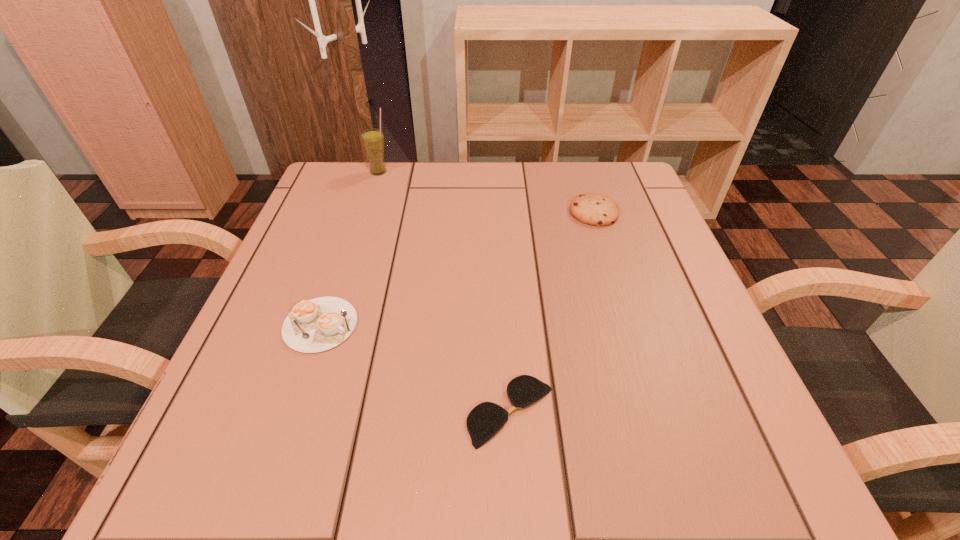
Identify the location of unoccupied area between the tallest object and the third object from left to right. (444, 292).

Where is `vacant area between the third tallest object and the shortest object`? vacant area between the third tallest object and the shortest object is located at coordinates (416, 368).

The height and width of the screenshot is (540, 960). What are the coordinates of `free space between the third farthest object and the second object from right to left` in the screenshot? It's located at (416, 368).

The image size is (960, 540). Identify the location of vacant area between the tallest object and the cappuccino. pos(349,248).

Locate an element on the screen. This screenshot has width=960, height=540. free space between the third object from left to right and the third tallest object is located at coordinates (416, 368).

Find the location of a particular element. The width and height of the screenshot is (960, 540). unoccupied area between the cappuccino and the shortest object is located at coordinates (416, 368).

This screenshot has width=960, height=540. In order to click on object that stands as the closest to the straw for drinking in this screenshot , I will do `click(316, 325)`.

In order to click on the closest object to the cappuccino in this screenshot , I will do [x=486, y=419].

At what (x,y) coordinates should I click in order to perform the action: click on vacant position in the image that satisfies the following two spatial constraints: 1. on the front side of the shortest object; 2. on the left side of the second nearest object. Please return your answer as a coordinate pair (x, y). This screenshot has height=540, width=960. Looking at the image, I should click on (291, 411).

Identify the location of vacant position in the image that satisfies the following two spatial constraints: 1. on the front side of the third farthest object; 2. on the right side of the nearest object. This screenshot has width=960, height=540. (291, 411).